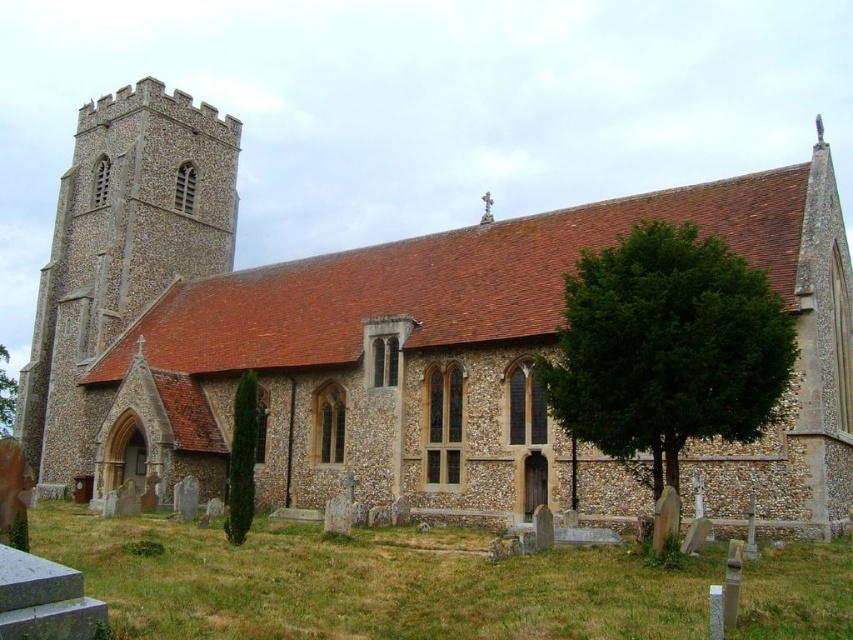
Question: Where is brown stone church at center located in relation to green textured tree at lower left in the image?

Choices:
 (A) above
 (B) below

Answer: (A)

Question: In this image, where is brown stone church at center located relative to green leafy tree at lower right?

Choices:
 (A) left
 (B) right

Answer: (A)

Question: Estimate the real-world distances between objects in this image. Which object is closer to the green leafy tree at lower right?

Choices:
 (A) green textured tree at lower left
 (B) green leafy tree at left

Answer: (A)

Question: Which point is closer to the camera?

Choices:
 (A) (253, 321)
 (B) (0, 436)
 (C) (582, 349)
 (D) (248, 480)

Answer: (C)

Question: Which object is positioned farthest from the green leafy tree at left?

Choices:
 (A) green textured tree at lower left
 (B) green leafy tree at lower right

Answer: (B)

Question: Can you confirm if brown stone church at center is positioned below green leafy tree at left?

Choices:
 (A) no
 (B) yes

Answer: (A)